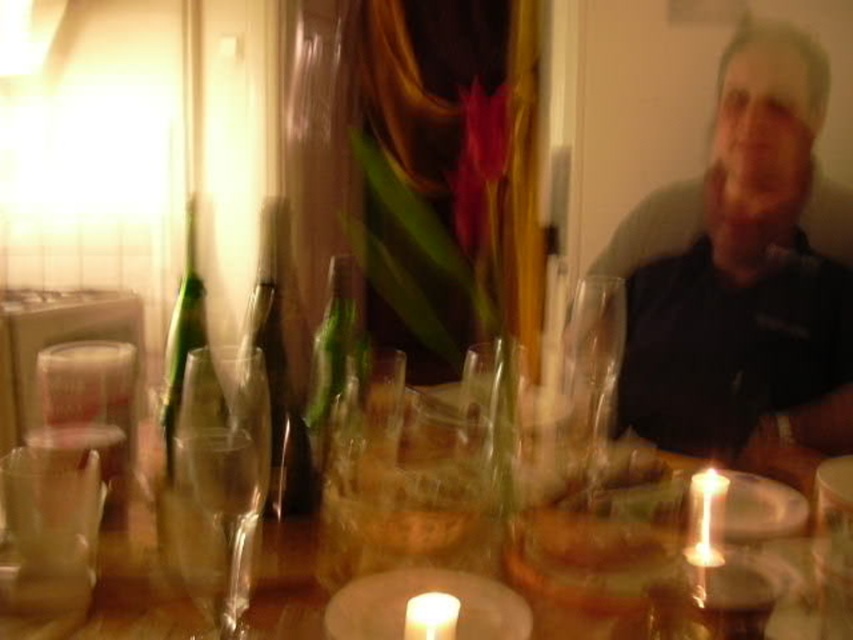
Can you confirm if clear glass wine glass at center is thinner than matte white candle at center?

No.

What do you see at coordinates (592, 364) in the screenshot?
I see `clear glass wine glass at center` at bounding box center [592, 364].

You are a GUI agent. You are given a task and a screenshot of the screen. Output one action in this format:
    pyautogui.click(x=<x>, y=<y>)
    Task: Click on the clear glass wine glass at center
    
    Given the screenshot: What is the action you would take?
    pyautogui.click(x=592, y=364)

Measure the distance from transparent glass wine glass at left to matte white candle at center.

The distance of transparent glass wine glass at left from matte white candle at center is 16.07 inches.

Does transparent glass wine glass at left have a larger size compared to matte white candle at center?

Correct, transparent glass wine glass at left is larger in size than matte white candle at center.

Measure the distance between point (215, 605) and camera.

The distance of point (215, 605) from camera is 25.92 inches.

The width and height of the screenshot is (853, 640). What are the coordinates of `transparent glass wine glass at left` in the screenshot? It's located at (222, 474).

Can you confirm if dark blue shirt at upper right is wider than white wax candle at center?

Indeed, dark blue shirt at upper right has a greater width compared to white wax candle at center.

Is dark blue shirt at upper right positioned before white wax candle at center?

No, dark blue shirt at upper right is behind white wax candle at center.

Who is more forward, (672, 429) or (434, 632)?

Point (434, 632) is more forward.

Find the location of a particular element. dark blue shirt at upper right is located at coordinates (741, 280).